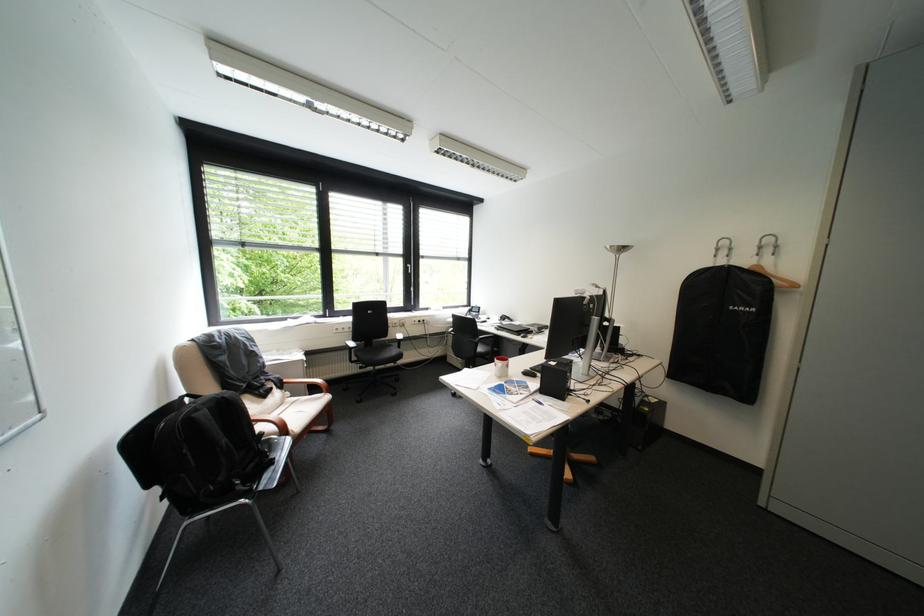
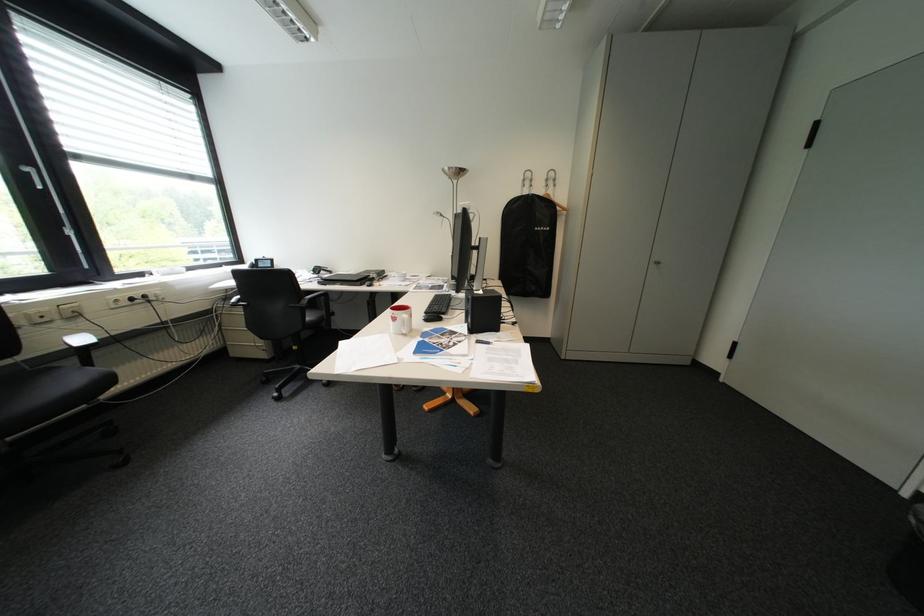
Locate, in the second image, the point that corresponds to point 420,265 in the first image.

(41, 169)